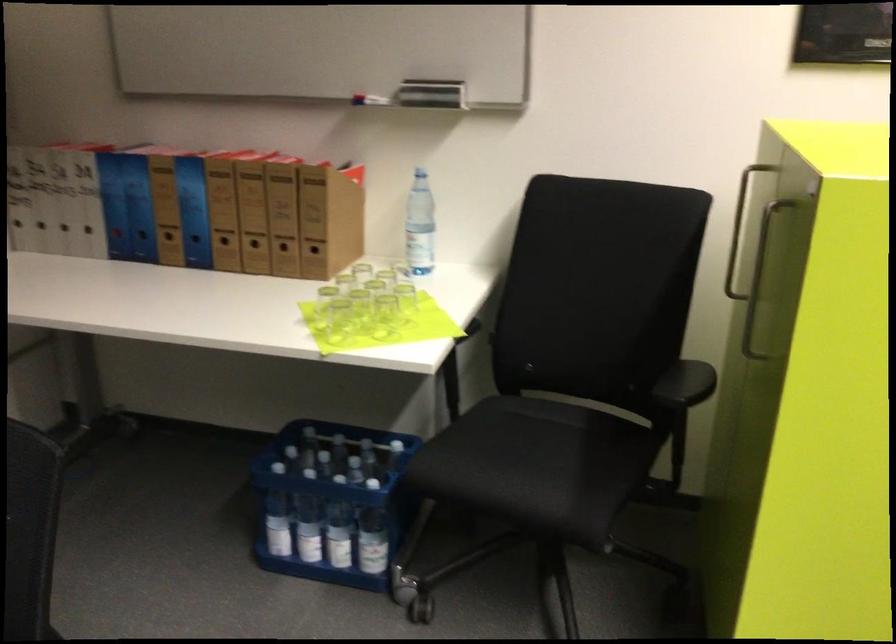
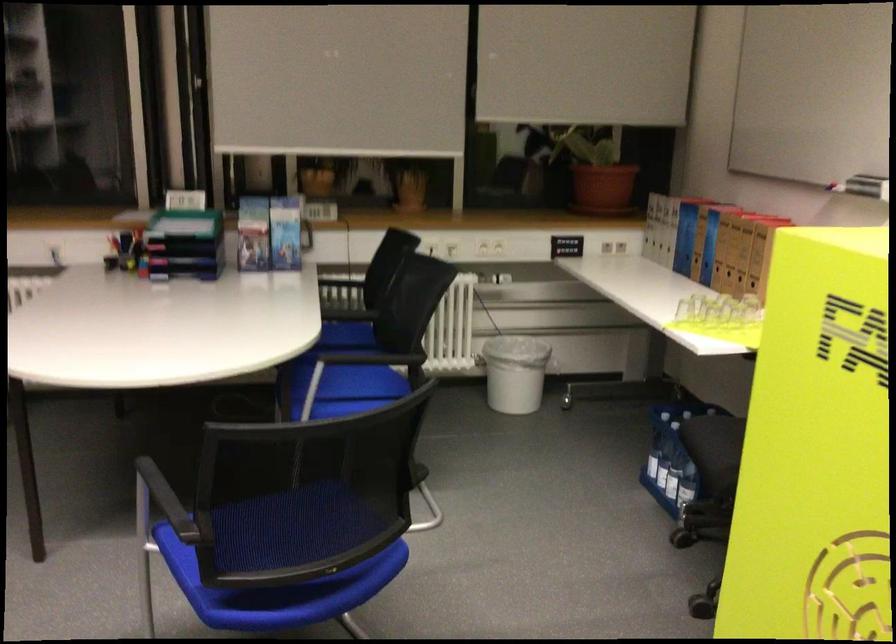
Where in the second image is the point corresponding to (282,205) from the first image?

(746, 243)